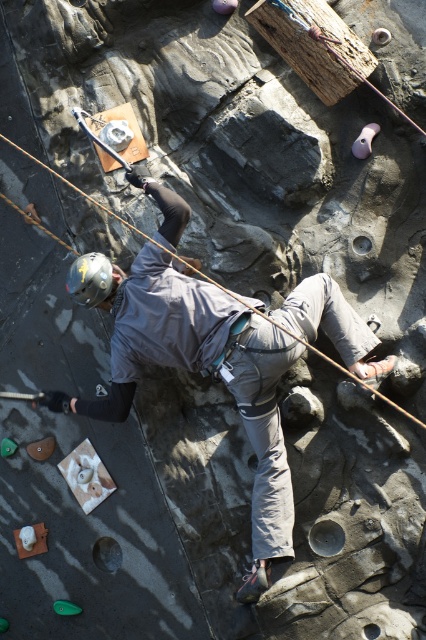
You are a safety inspector checking the climbing wall setup. You notice the gray fabric jacket at center and the matte gray helmet at center. According to safety guidelines, the helmet must be positioned higher than the jacket to ensure proper coverage. Does the current arrangement comply with this requirement?

The gray fabric jacket at center is much taller than the matte gray helmet at center. Since the jacket is taller, the helmet is not positioned higher as required, so the arrangement does not comply with safety guidelines.

You are a rock climber preparing to ascend the climbing wall. You notice both the gray fabric jacket at center and the matte gray helmet at center. Which item is positioned to the right side of the other?

The gray fabric jacket at center is to the right of the matte gray helmet at center.

You are a safety inspector observing the climber. You notice the gray fabric jacket at center and the matte gray helmet at center. According to safety protocols, which item should be positioned closer to the climber for optimal protection?

The matte gray helmet at center should be positioned closer to the climber since it is a safety gear that needs to be worn properly. However, according to the Objects Description, the gray fabric jacket at center is in front of the matte gray helmet at center, which means the jacket is blocking the helmet and not allowing it to be in the correct position for optimal protection.